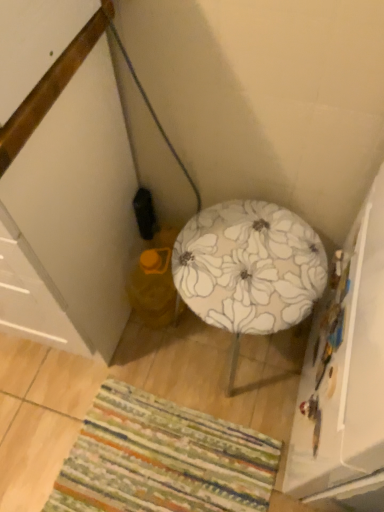
Question: Are yellow fabric bean bag chair at lower left and floral fabric stool at center located far from each other?

Choices:
 (A) yes
 (B) no

Answer: (B)

Question: Is the position of yellow fabric bean bag chair at lower left more distant than that of floral fabric stool at center?

Choices:
 (A) yes
 (B) no

Answer: (A)

Question: Is yellow fabric bean bag chair at lower left to the left of floral fabric stool at center from the viewer's perspective?

Choices:
 (A) yes
 (B) no

Answer: (A)

Question: Considering the relative sizes of yellow fabric bean bag chair at lower left and floral fabric stool at center in the image provided, is yellow fabric bean bag chair at lower left shorter than floral fabric stool at center?

Choices:
 (A) yes
 (B) no

Answer: (A)

Question: Is yellow fabric bean bag chair at lower left placed right next to floral fabric stool at center?

Choices:
 (A) no
 (B) yes

Answer: (A)

Question: From the image's perspective, is yellow fabric bean bag chair at lower left located beneath floral fabric stool at center?

Choices:
 (A) yes
 (B) no

Answer: (B)

Question: Can we say yellow fabric bean bag chair at lower left lies outside white glossy cabinet at lower left?

Choices:
 (A) no
 (B) yes

Answer: (B)

Question: Is yellow fabric bean bag chair at lower left smaller than white glossy cabinet at lower left?

Choices:
 (A) yes
 (B) no

Answer: (A)

Question: Considering the relative sizes of yellow fabric bean bag chair at lower left and white glossy cabinet at lower left in the image provided, is yellow fabric bean bag chair at lower left shorter than white glossy cabinet at lower left?

Choices:
 (A) yes
 (B) no

Answer: (A)

Question: Is yellow fabric bean bag chair at lower left next to white glossy cabinet at lower left and touching it?

Choices:
 (A) no
 (B) yes

Answer: (A)

Question: Is yellow fabric bean bag chair at lower left at the right side of white glossy cabinet at lower left?

Choices:
 (A) no
 (B) yes

Answer: (B)

Question: Considering the relative sizes of yellow fabric bean bag chair at lower left and white glossy cabinet at lower left in the image provided, is yellow fabric bean bag chair at lower left taller than white glossy cabinet at lower left?

Choices:
 (A) yes
 (B) no

Answer: (B)

Question: Does multicolored woven mat at lower center lie behind floral fabric stool at center?

Choices:
 (A) yes
 (B) no

Answer: (A)